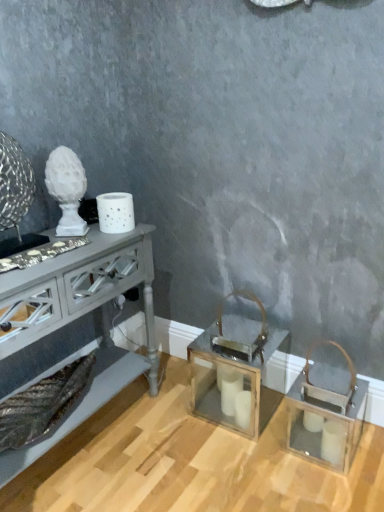
Looking at this image, what is the approximate width of matte gray console table at left, acting as the second table starting from the right?

matte gray console table at left, acting as the second table starting from the right, is 12.21 inches wide.

Measure the distance between matte gray console table at left, acting as the second table starting from the right, and camera.

They are 3.67 feet apart.

The width and height of the screenshot is (384, 512). Find the location of `matte gray console table at left, which is the first table in left-to-right order`. matte gray console table at left, which is the first table in left-to-right order is located at coordinates (75, 327).

Describe the element at coordinates (75, 327) in the screenshot. The height and width of the screenshot is (512, 384). I see `matte gray console table at left, acting as the second table starting from the right` at that location.

At what (x,y) coordinates should I click in order to perform the action: click on clear glass lantern at center, the 2th table in the left-to-right sequence. Please return your answer as a coordinate pair (x, y). Image resolution: width=384 pixels, height=512 pixels. Looking at the image, I should click on (240, 374).

Image resolution: width=384 pixels, height=512 pixels. Describe the element at coordinates (240, 374) in the screenshot. I see `clear glass lantern at center, the 1th table positioned from the right` at that location.

I want to click on matte gray console table at left, acting as the second table starting from the right, so click(x=75, y=327).

Is matte gray console table at left, which is the first table in left-to-right order, at the left side of clear glass lantern at center, the 2th table in the left-to-right sequence?

Yes.

Which is in front, matte gray console table at left, which is the first table in left-to-right order, or clear glass lantern at center, the 2th table in the left-to-right sequence?

matte gray console table at left, which is the first table in left-to-right order.

Between point (7, 460) and point (189, 356), which one is positioned behind?

The point (189, 356) is farther.

From the image's perspective, is matte gray console table at left, which is the first table in left-to-right order, positioned above or below clear glass lantern at center, the 1th table positioned from the right?

matte gray console table at left, which is the first table in left-to-right order, is situated higher than clear glass lantern at center, the 1th table positioned from the right, in the image.

From a real-world perspective, which is physically above, matte gray console table at left, acting as the second table starting from the right, or clear glass lantern at center, the 1th table positioned from the right?

matte gray console table at left, acting as the second table starting from the right, from a real-world perspective.

Considering the sizes of matte gray console table at left, acting as the second table starting from the right, and clear glass lantern at center, the 2th table in the left-to-right sequence, in the image, is matte gray console table at left, acting as the second table starting from the right, wider or thinner than clear glass lantern at center, the 2th table in the left-to-right sequence,?

Clearly, matte gray console table at left, acting as the second table starting from the right, has more width compared to clear glass lantern at center, the 2th table in the left-to-right sequence.

Does matte gray console table at left, which is the first table in left-to-right order, have a lesser height compared to clear glass lantern at center, the 1th table positioned from the right?

No.

Considering the relative sizes of matte gray console table at left, acting as the second table starting from the right, and clear glass lantern at center, the 2th table in the left-to-right sequence, in the image provided, is matte gray console table at left, acting as the second table starting from the right, bigger than clear glass lantern at center, the 2th table in the left-to-right sequence,?

Correct, matte gray console table at left, acting as the second table starting from the right, is larger in size than clear glass lantern at center, the 2th table in the left-to-right sequence.

Would you say clear glass lantern at center, the 1th table positioned from the right, is part of matte gray console table at left, which is the first table in left-to-right order,'s contents?

No, clear glass lantern at center, the 1th table positioned from the right, is located outside of matte gray console table at left, which is the first table in left-to-right order.

Is there a large distance between matte gray console table at left, acting as the second table starting from the right, and clear glass lantern at center, the 1th table positioned from the right?

No, matte gray console table at left, acting as the second table starting from the right, is not far from clear glass lantern at center, the 1th table positioned from the right.

Could you tell me if matte gray console table at left, which is the first table in left-to-right order, is turned towards clear glass lantern at center, the 2th table in the left-to-right sequence?

Yes, matte gray console table at left, which is the first table in left-to-right order, is aimed at clear glass lantern at center, the 2th table in the left-to-right sequence.

How different are the orientations of matte gray console table at left, which is the first table in left-to-right order, and clear glass lantern at center, the 2th table in the left-to-right sequence, in degrees?

The angle between the facing direction of matte gray console table at left, which is the first table in left-to-right order, and the facing direction of clear glass lantern at center, the 2th table in the left-to-right sequence, is 86.8 degrees.

Measure the distance between matte gray console table at left, which is the first table in left-to-right order, and clear glass lantern at center, the 2th table in the left-to-right sequence.

matte gray console table at left, which is the first table in left-to-right order, is 19.06 inches from clear glass lantern at center, the 2th table in the left-to-right sequence.

You are a GUI agent. You are given a task and a screenshot of the screen. Output one action in this format:
    pyautogui.click(x=<x>, y=<y>)
    Task: Click on the table on the right of matte gray console table at left, which is the first table in left-to-right order
    Image resolution: width=384 pixels, height=512 pixels.
    Given the screenshot: What is the action you would take?
    pyautogui.click(x=240, y=374)

Which is more to the right, clear glass lantern at center, the 1th table positioned from the right, or matte gray console table at left, which is the first table in left-to-right order?

clear glass lantern at center, the 1th table positioned from the right, is more to the right.

Does clear glass lantern at center, the 2th table in the left-to-right sequence, come in front of matte gray console table at left, which is the first table in left-to-right order?

No, it is not.

Considering the points (205, 349) and (6, 451), which point is in front, point (205, 349) or point (6, 451)?

The point (6, 451) is closer.

From the image's perspective, which one is positioned lower, clear glass lantern at center, the 1th table positioned from the right, or matte gray console table at left, which is the first table in left-to-right order?

clear glass lantern at center, the 1th table positioned from the right, appears lower in the image.

From a real-world perspective, between clear glass lantern at center, the 1th table positioned from the right, and matte gray console table at left, acting as the second table starting from the right, who is vertically lower?

From a 3D spatial view, clear glass lantern at center, the 1th table positioned from the right, is below.

Is clear glass lantern at center, the 1th table positioned from the right, wider or thinner than matte gray console table at left, which is the first table in left-to-right order?

clear glass lantern at center, the 1th table positioned from the right, is thinner than matte gray console table at left, which is the first table in left-to-right order.

Considering the relative sizes of clear glass lantern at center, the 2th table in the left-to-right sequence, and matte gray console table at left, acting as the second table starting from the right, in the image provided, is clear glass lantern at center, the 2th table in the left-to-right sequence, shorter than matte gray console table at left, acting as the second table starting from the right,?

Yes, clear glass lantern at center, the 2th table in the left-to-right sequence, is shorter than matte gray console table at left, acting as the second table starting from the right.

Is clear glass lantern at center, the 2th table in the left-to-right sequence, bigger or smaller than matte gray console table at left, which is the first table in left-to-right order?

clear glass lantern at center, the 2th table in the left-to-right sequence, is smaller than matte gray console table at left, which is the first table in left-to-right order.

Is clear glass lantern at center, the 1th table positioned from the right, positioned beyond the bounds of matte gray console table at left, acting as the second table starting from the right?

clear glass lantern at center, the 1th table positioned from the right, is positioned outside matte gray console table at left, acting as the second table starting from the right.

Is clear glass lantern at center, the 2th table in the left-to-right sequence, positioned far away from matte gray console table at left, which is the first table in left-to-right order?

No.

Could you tell me if clear glass lantern at center, the 1th table positioned from the right, is turned towards matte gray console table at left, acting as the second table starting from the right?

No, clear glass lantern at center, the 1th table positioned from the right, is not facing towards matte gray console table at left, acting as the second table starting from the right.

Based on the photo, how different are the orientations of clear glass lantern at center, the 2th table in the left-to-right sequence, and matte gray console table at left, acting as the second table starting from the right, in degrees?

They differ by 86.8 degrees in their facing directions.

Where is `table above the clear glass lantern at center, the 2th table in the left-to-right sequence (from a real-world perspective)`? The image size is (384, 512). table above the clear glass lantern at center, the 2th table in the left-to-right sequence (from a real-world perspective) is located at coordinates (75, 327).

Where is `table above the clear glass lantern at center, the 1th table positioned from the right (from the image's perspective)`? This screenshot has width=384, height=512. table above the clear glass lantern at center, the 1th table positioned from the right (from the image's perspective) is located at coordinates (75, 327).

Image resolution: width=384 pixels, height=512 pixels. What are the coordinates of `table below the matte gray console table at left, which is the first table in left-to-right order (from a real-world perspective)` in the screenshot? It's located at (240, 374).